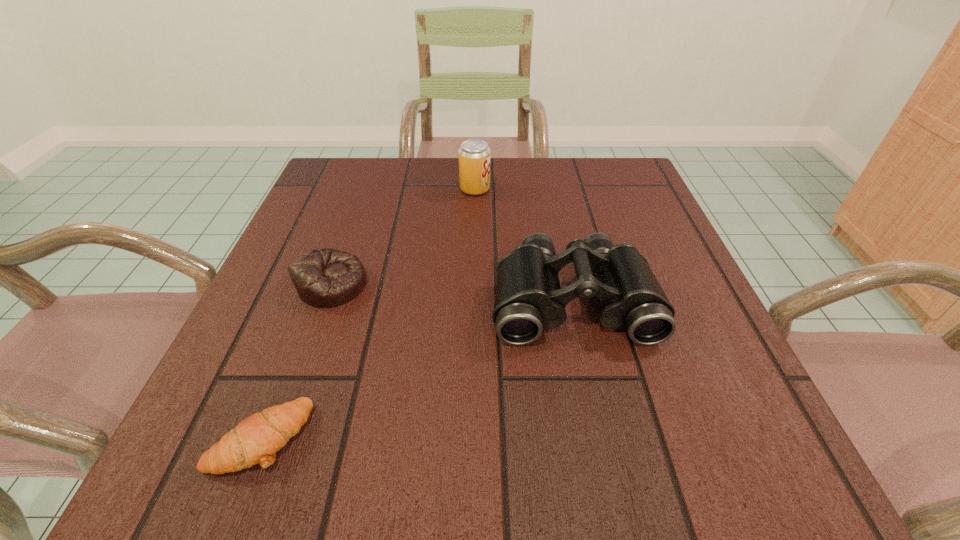
Locate an element on the screen. beanbag present at the left edge is located at coordinates (324, 278).

What are the coordinates of `crescent roll located at the left edge` in the screenshot? It's located at (256, 439).

Image resolution: width=960 pixels, height=540 pixels. Find the location of `object present at the right edge`. object present at the right edge is located at coordinates (528, 298).

You are a GUI agent. You are given a task and a screenshot of the screen. Output one action in this format:
    pyautogui.click(x=<x>, y=<y>)
    Task: Click on the object positioned at the near left corner
    
    Given the screenshot: What is the action you would take?
    pyautogui.click(x=256, y=439)

You are a GUI agent. You are given a task and a screenshot of the screen. Output one action in this format:
    pyautogui.click(x=<x>, y=<y>)
    Task: Click on the vacant space at the far edge
    This screenshot has height=540, width=960.
    Given the screenshot: What is the action you would take?
    pyautogui.click(x=504, y=195)

At what (x,y) coordinates should I click in order to perform the action: click on blank area at the near edge. Please return your answer as a coordinate pair (x, y). This screenshot has height=540, width=960. Looking at the image, I should click on (520, 475).

The width and height of the screenshot is (960, 540). I want to click on vacant region at the left edge of the desktop, so 350,241.

Locate an element on the screen. This screenshot has width=960, height=540. free location at the right edge is located at coordinates (616, 212).

Identify the location of free space at the near left corner of the desktop. (241, 486).

The height and width of the screenshot is (540, 960). Find the location of `free location at the far right corner of the desktop`. free location at the far right corner of the desktop is located at coordinates (645, 193).